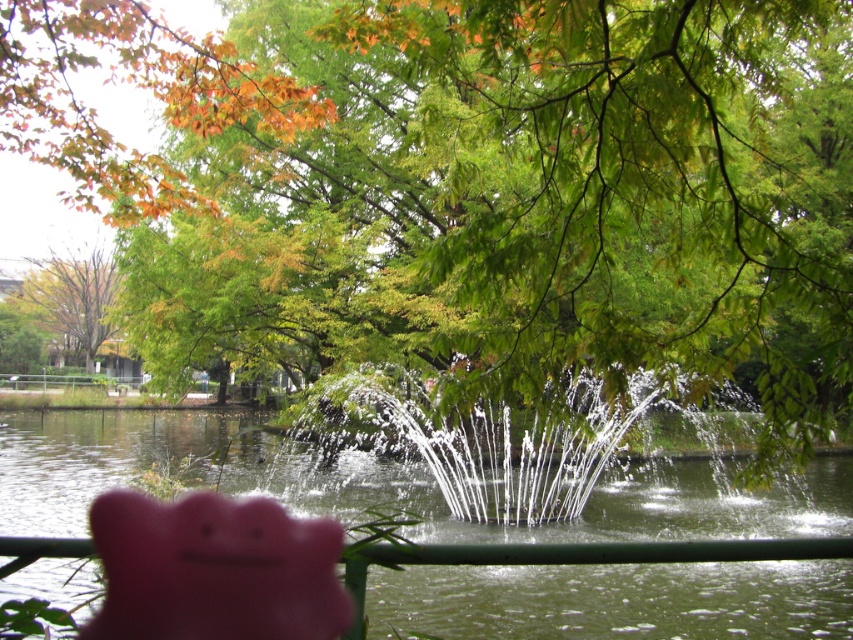
Question: Is clear water at fountain center above green leafy tree at upper left?

Choices:
 (A) no
 (B) yes

Answer: (A)

Question: Among these objects, which one is farthest from the camera?

Choices:
 (A) pink rubber piggy bank at lower center
 (B) green leafy tree at upper left

Answer: (B)

Question: Does clear water at fountain center appear under green leafy tree at upper left?

Choices:
 (A) yes
 (B) no

Answer: (A)

Question: Among these points, which one is nearest to the camera?

Choices:
 (A) (202, 508)
 (B) (715, 524)

Answer: (A)

Question: Is clear water at fountain center to the right of green leafy tree at upper left from the viewer's perspective?

Choices:
 (A) no
 (B) yes

Answer: (B)

Question: Which point is closer to the camera taking this photo?

Choices:
 (A) (231, 468)
 (B) (28, 275)
 (C) (125, 595)

Answer: (C)